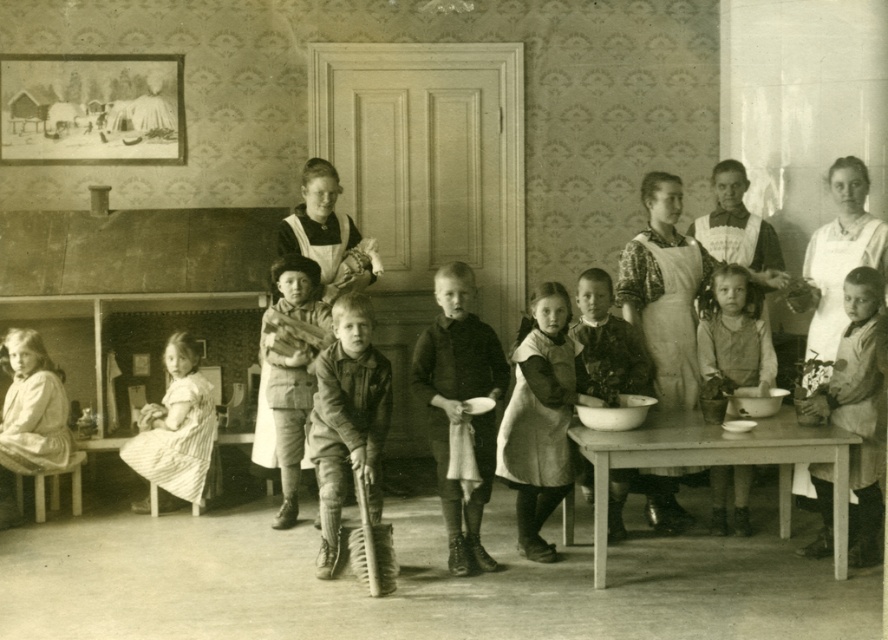
Question: Which of these objects is positioned farthest from the light brown fabric dress at center?

Choices:
 (A) wooden table at center
 (B) matte brown apron at lower right
 (C) wooden broom at center
 (D) light brown wool sweater at center

Answer: (D)

Question: Which object is farther from the camera taking this photo?

Choices:
 (A) wooden broom at center
 (B) light brown fabric dress at center

Answer: (A)

Question: Can you confirm if wooden table at center is positioned to the left of matte brown apron at lower right?

Choices:
 (A) yes
 (B) no

Answer: (A)

Question: Is light brown fabric dress at center to the left of striped cotton dress at center from the viewer's perspective?

Choices:
 (A) no
 (B) yes

Answer: (A)

Question: Which of these objects is positioned farthest from the rough leather jacket at center?

Choices:
 (A) wooden table at center
 (B) light brown wool sweater at center
 (C) wooden broom at center
 (D) striped cotton dress at center

Answer: (D)

Question: Where is wooden table at center located in relation to rough leather jacket at center in the image?

Choices:
 (A) above
 (B) below

Answer: (B)